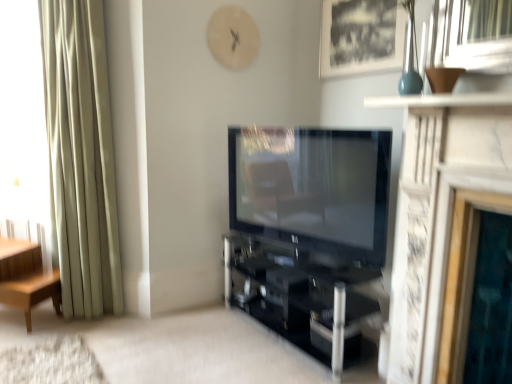
Question: Can you confirm if black glass shelf at center is thinner than light brown wood side table at left?

Choices:
 (A) no
 (B) yes

Answer: (A)

Question: From a real-world perspective, does black glass shelf at center stand above light brown wood side table at left?

Choices:
 (A) no
 (B) yes

Answer: (B)

Question: Is the position of black glass shelf at center more distant than that of light brown wood side table at left?

Choices:
 (A) yes
 (B) no

Answer: (B)

Question: Is black glass shelf at center shorter than light brown wood side table at left?

Choices:
 (A) no
 (B) yes

Answer: (B)

Question: Is black glass shelf at center to the left of light brown wood side table at left from the viewer's perspective?

Choices:
 (A) yes
 (B) no

Answer: (B)

Question: Looking at the image, does matte black tv at center seem bigger or smaller compared to silky beige curtain at left?

Choices:
 (A) big
 (B) small

Answer: (B)

Question: From the image's perspective, is matte black tv at center above or below silky beige curtain at left?

Choices:
 (A) above
 (B) below

Answer: (B)

Question: In terms of height, does matte black tv at center look taller or shorter compared to silky beige curtain at left?

Choices:
 (A) short
 (B) tall

Answer: (A)

Question: Considering their positions, is matte black tv at center located in front of or behind silky beige curtain at left?

Choices:
 (A) behind
 (B) front

Answer: (B)

Question: From the image's perspective, is black matte picture frame at upper center above or below black glass shelf at center?

Choices:
 (A) above
 (B) below

Answer: (A)

Question: Considering the positions of black matte picture frame at upper center and black glass shelf at center in the image, is black matte picture frame at upper center bigger or smaller than black glass shelf at center?

Choices:
 (A) small
 (B) big

Answer: (A)

Question: In terms of width, does black matte picture frame at upper center look wider or thinner when compared to black glass shelf at center?

Choices:
 (A) thin
 (B) wide

Answer: (A)

Question: Is black matte picture frame at upper center spatially inside black glass shelf at center, or outside of it?

Choices:
 (A) outside
 (B) inside

Answer: (A)

Question: Considering their positions, is white marble fireplace at center located in front of or behind black glass shelf at center?

Choices:
 (A) front
 (B) behind

Answer: (A)

Question: Considering the positions of point (506, 115) and point (302, 329), is point (506, 115) closer or farther from the camera than point (302, 329)?

Choices:
 (A) closer
 (B) farther

Answer: (A)